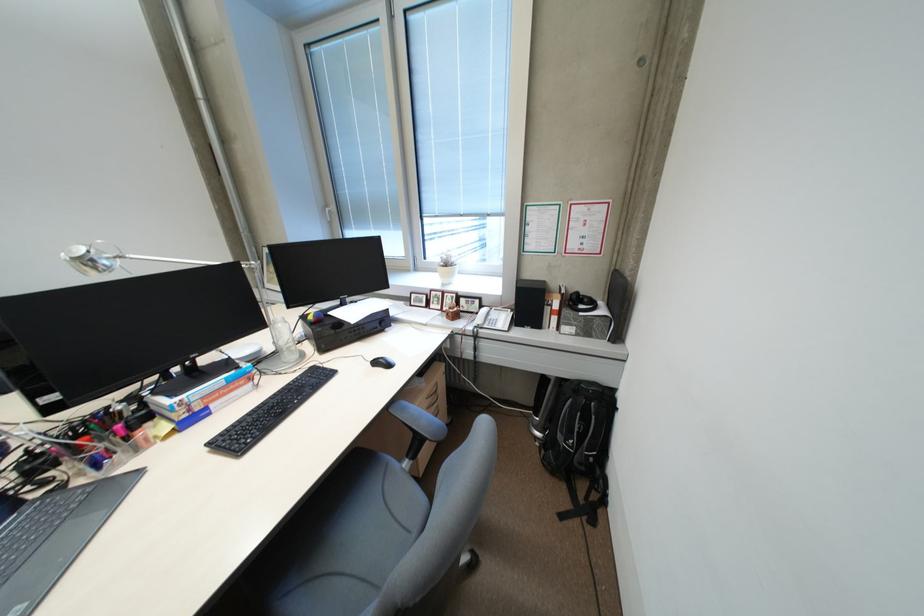
Which object does [565,336] point to?

This point indicates the red binder.